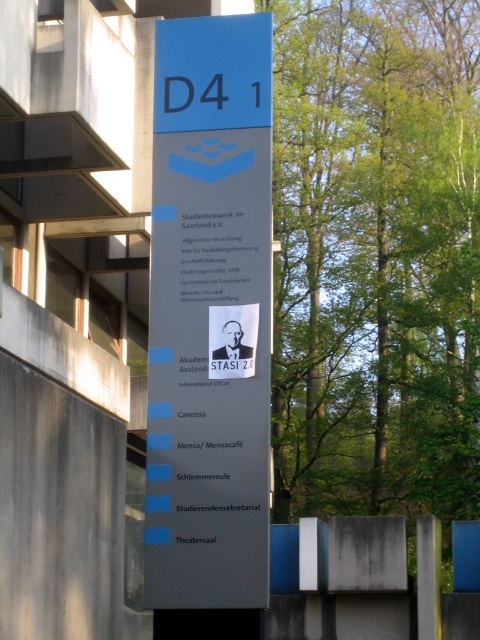
Question: Is blue plastic sign at center below black paper at center?

Choices:
 (A) yes
 (B) no

Answer: (A)

Question: Among these objects, which one is nearest to the camera?

Choices:
 (A) black paper at center
 (B) blue plastic sign at center

Answer: (B)

Question: Is blue plastic sign at center to the left of black paper at center from the viewer's perspective?

Choices:
 (A) yes
 (B) no

Answer: (A)

Question: Can you confirm if blue plastic sign at center is positioned to the left of black paper at center?

Choices:
 (A) no
 (B) yes

Answer: (B)

Question: Which object is farther from the camera taking this photo?

Choices:
 (A) blue plastic sign at center
 (B) black paper at center

Answer: (B)

Question: Which point appears closest to the camera in this image?

Choices:
 (A) (228, 291)
 (B) (251, 150)

Answer: (A)